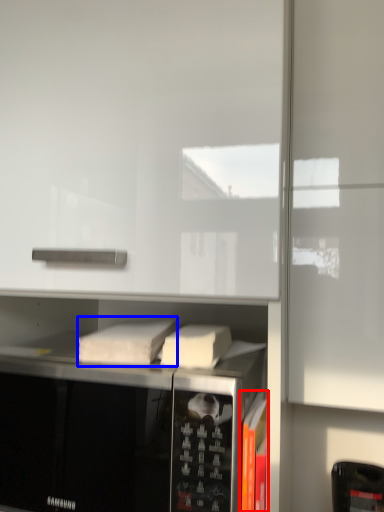
Question: Which object appears farthest to the camera in this image, book (highlighted by a red box) or book (highlighted by a blue box)?

Choices:
 (A) book
 (B) book

Answer: (B)